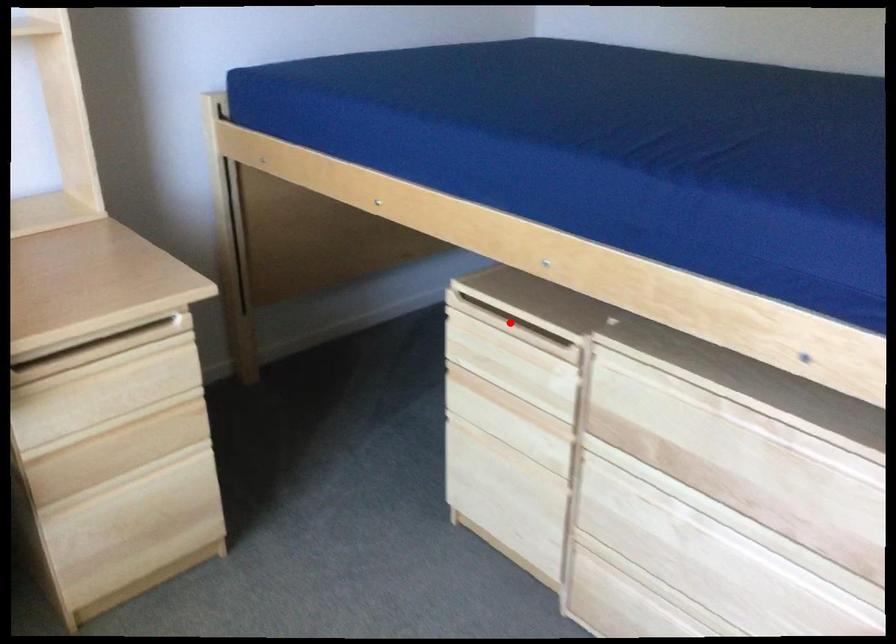
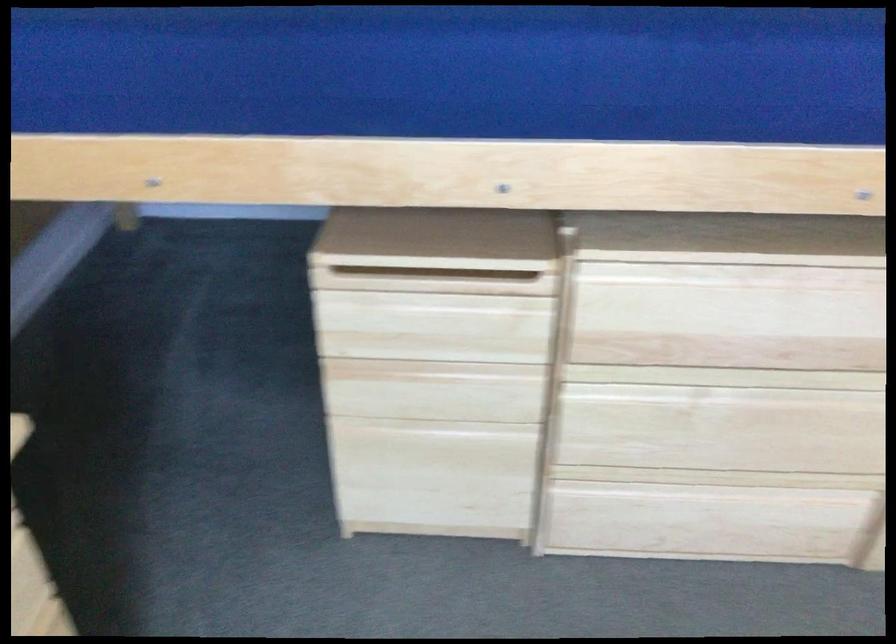
Question: I am providing you with two images of the same scene from different viewpoints. Given a red point in image1, look at the same physical point in image2. Is it:

Choices:
 (A) Closer to the viewpoint
 (B) Farther from the viewpoint

Answer: (A)